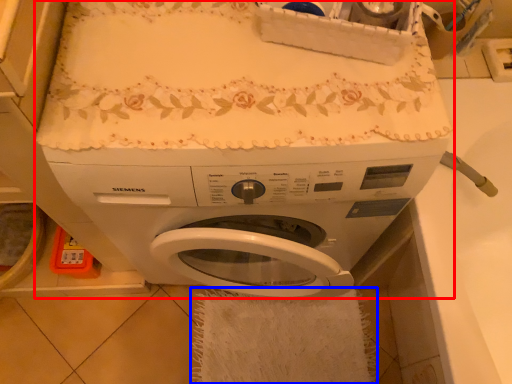
Question: Among these objects, which one is farthest to the camera, washing machine (highlighted by a red box) or bath towel (highlighted by a blue box)?

Choices:
 (A) washing machine
 (B) bath towel

Answer: (B)